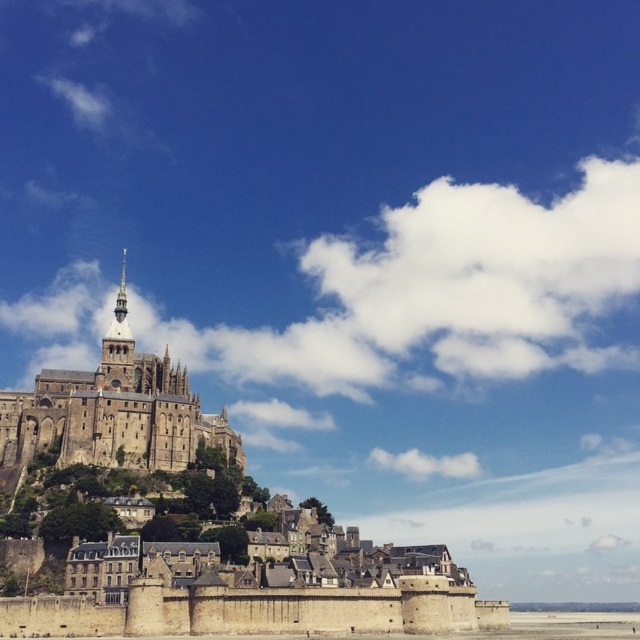
Who is taller, golden stone tower at upper left or clear blue water at lower center?

golden stone tower at upper left is taller.

Does point (116, 387) come farther from viewer compared to point (586, 609)?

That is False.

You are a GUI agent. You are given a task and a screenshot of the screen. Output one action in this format:
    pyautogui.click(x=<x>, y=<y>)
    Task: Click on the golden stone tower at upper left
    This screenshot has width=640, height=640.
    Given the screenshot: What is the action you would take?
    pyautogui.click(x=116, y=346)

You are a GUI agent. You are given a task and a screenshot of the screen. Output one action in this format:
    pyautogui.click(x=<x>, y=<y>)
    Task: Click on the golden stone tower at upper left
    This screenshot has height=640, width=640.
    Given the screenshot: What is the action you would take?
    pyautogui.click(x=116, y=346)

Which of these two, brown stone castle at center or clear blue water at lower center, stands taller?

Standing taller between the two is brown stone castle at center.

Can you confirm if brown stone castle at center is smaller than clear blue water at lower center?

Incorrect, brown stone castle at center is not smaller in size than clear blue water at lower center.

Is point (28, 396) in front of point (576, 611)?

Yes.

Image resolution: width=640 pixels, height=640 pixels. What are the coordinates of `brown stone castle at center` in the screenshot? It's located at (113, 412).

In the scene shown: Is brown stone castle at center in front of golden stone tower at upper left?

Yes, it is in front of golden stone tower at upper left.

Between brown stone castle at center and golden stone tower at upper left, which one appears on the left side from the viewer's perspective?

golden stone tower at upper left is more to the left.

Is point (125, 429) closer to camera compared to point (108, 380)?

Yes, point (125, 429) is closer to viewer.

Find the location of `brown stone castle at center`. brown stone castle at center is located at coordinates (113, 412).